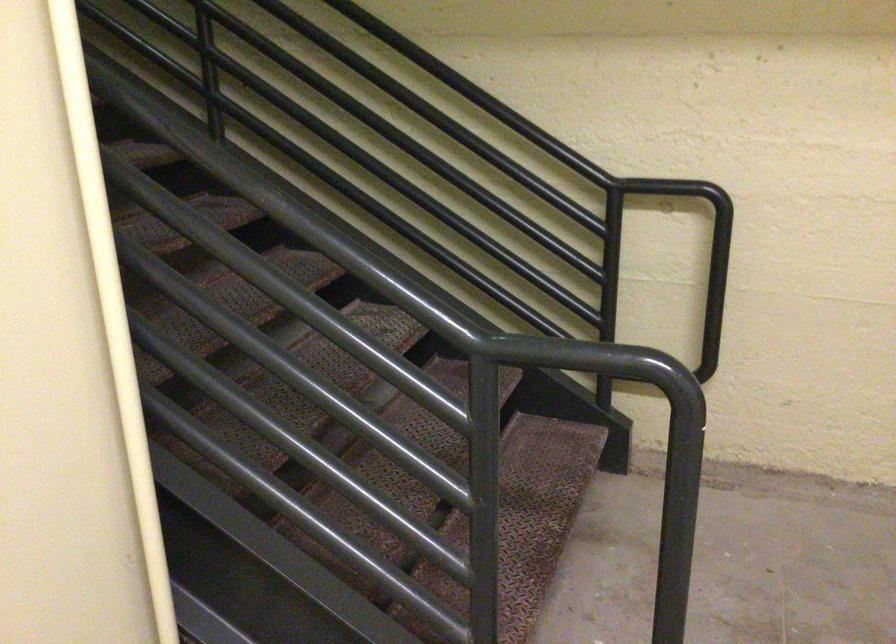
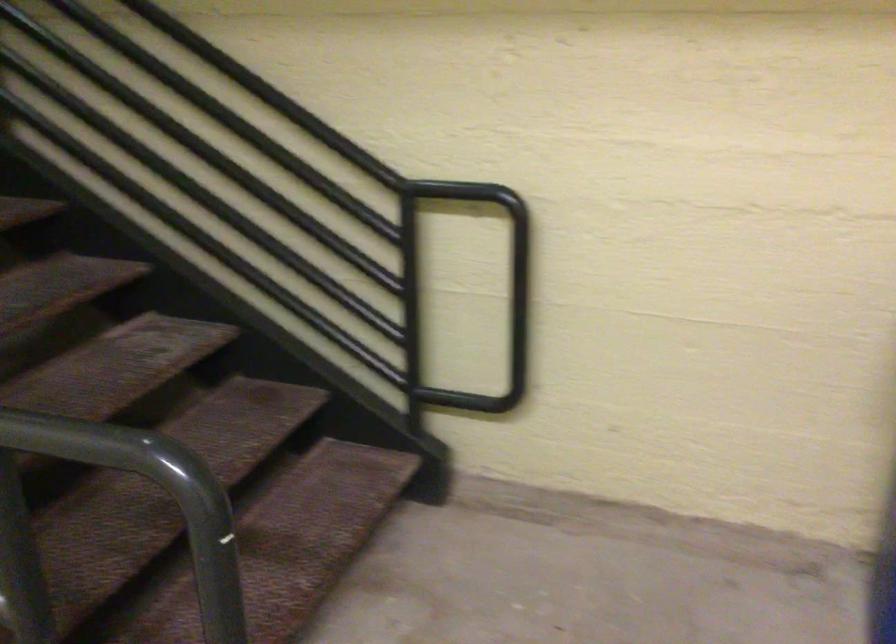
Find the pixel in the second image that matches pixel 685 275 in the first image.

(495, 301)